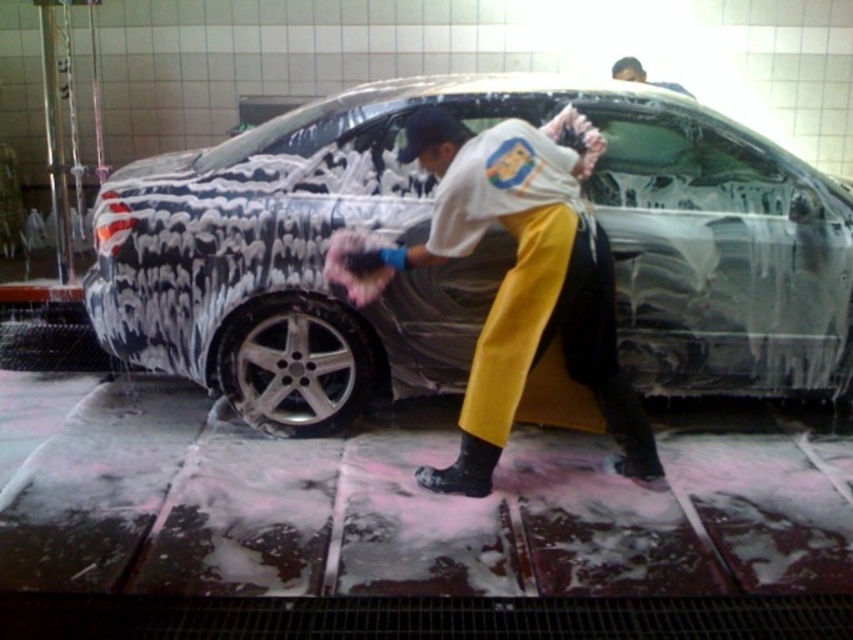
You are standing in a car wash facility and want to reach a specific point marked at coordinates point (345, 316). If your reach extends 1 meter, can you touch that point without moving?

The distance between you and point (345, 316) is 3.49 meters, which is greater than your 1 meter reach. Therefore, you cannot touch it without moving.